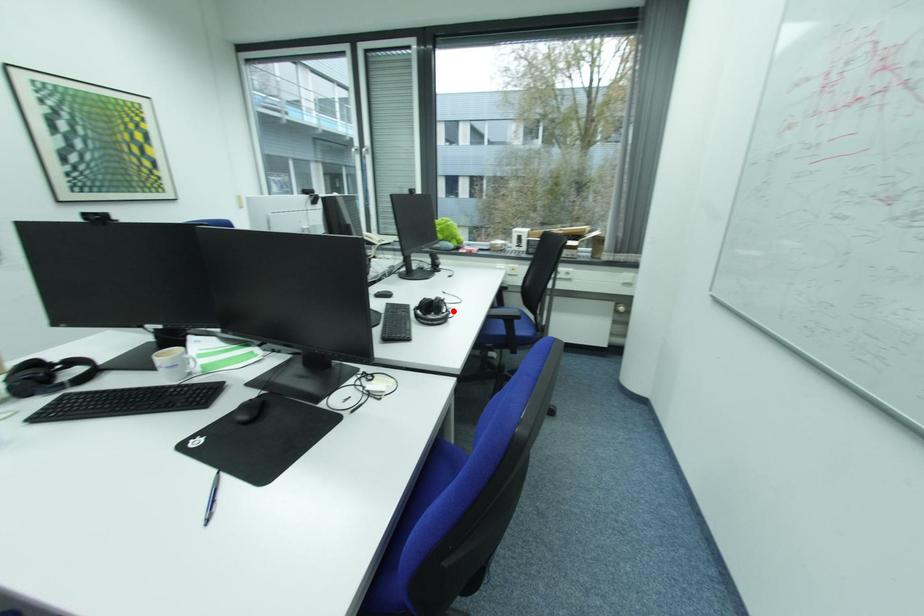
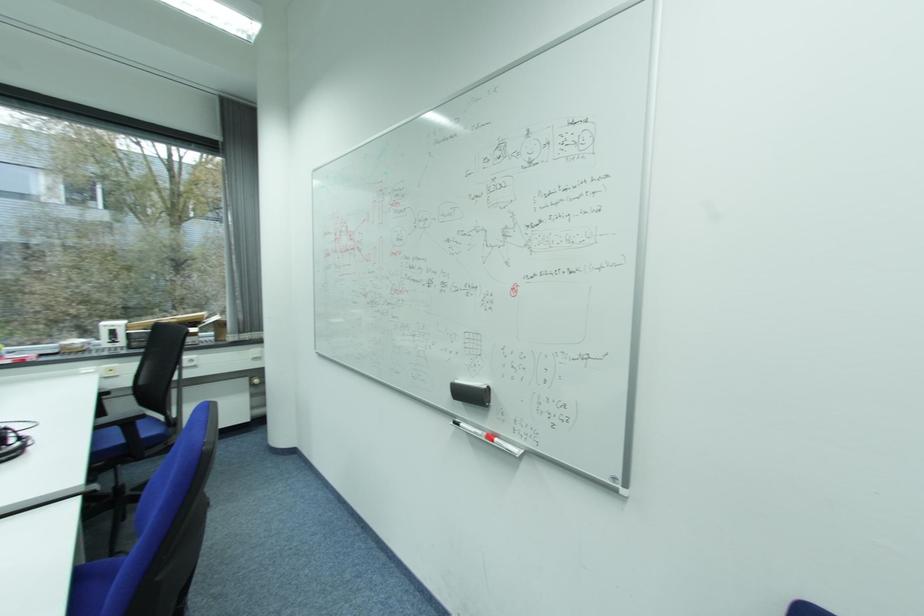
In the second image, find the point that corresponds to the highlighted location in the first image.

(20, 442)